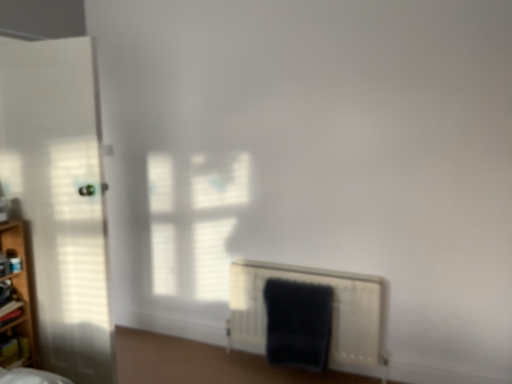
The height and width of the screenshot is (384, 512). In order to click on white matte radiator at lower center in this screenshot , I will do `click(332, 313)`.

This screenshot has height=384, width=512. Describe the element at coordinates (59, 196) in the screenshot. I see `white matte door at left` at that location.

Where is `dark blue plush bath towel at lower right`? This screenshot has height=384, width=512. dark blue plush bath towel at lower right is located at coordinates (298, 323).

The height and width of the screenshot is (384, 512). Find the location of `white matte radiator at lower center`. white matte radiator at lower center is located at coordinates (332, 313).

Considering the sizes of objects dark blue plush bath towel at lower right and white matte radiator at lower center in the image provided, who is smaller, dark blue plush bath towel at lower right or white matte radiator at lower center?

dark blue plush bath towel at lower right.

From the picture: Considering the positions of objects dark blue plush bath towel at lower right and white matte radiator at lower center in the image provided, who is more to the left, dark blue plush bath towel at lower right or white matte radiator at lower center?

dark blue plush bath towel at lower right is more to the left.

In order to click on bath towel that appears behind the white matte radiator at lower center in this screenshot , I will do `click(298, 323)`.

Can you see dark blue plush bath towel at lower right touching white matte radiator at lower center?

No, dark blue plush bath towel at lower right is not making contact with white matte radiator at lower center.

Is point (27, 260) positioned after point (7, 152)?

That is True.

Based on the photo, which of these two, wooden shelf at left or white matte door at left, is smaller?

Smaller between the two is wooden shelf at left.

Identify the location of door that is above the wooden shelf at left (from the image's perspective). The height and width of the screenshot is (384, 512). (59, 196).

Which object is wider, wooden shelf at left or white matte door at left?

With larger width is white matte door at left.

What's the angular difference between dark blue plush bath towel at lower right and wooden shelf at left's facing directions?

They differ by 87.2 degrees in their facing directions.

From the image's perspective, relative to wooden shelf at left, is dark blue plush bath towel at lower right above or below?

Based on their image positions, dark blue plush bath towel at lower right is located beneath wooden shelf at left.

Who is shorter, dark blue plush bath towel at lower right or wooden shelf at left?

Standing shorter between the two is dark blue plush bath towel at lower right.

Between dark blue plush bath towel at lower right and wooden shelf at left, which one has larger width?

wooden shelf at left is wider.

Looking at their sizes, would you say dark blue plush bath towel at lower right is wider or thinner than white matte door at left?

Clearly, dark blue plush bath towel at lower right has less width compared to white matte door at left.

Considering the points (285, 305) and (82, 50), which point is behind, point (285, 305) or point (82, 50)?

The point (285, 305) is farther.

From the image's perspective, is dark blue plush bath towel at lower right located beneath white matte door at left?

Correct, dark blue plush bath towel at lower right appears lower than white matte door at left in the image.

How different are the orientations of dark blue plush bath towel at lower right and white matte door at left in degrees?

The angle between the facing direction of dark blue plush bath towel at lower right and the facing direction of white matte door at left is 91 degrees.

Is white matte door at left situated inside wooden shelf at left or outside?

white matte door at left cannot be found inside wooden shelf at left.

Between white matte door at left and wooden shelf at left, which one has smaller size?

wooden shelf at left.

Is white matte door at left directly adjacent to wooden shelf at left?

No, white matte door at left is not in contact with wooden shelf at left.

Is white matte door at left aimed at wooden shelf at left?

No, white matte door at left is not facing towards wooden shelf at left.

Are white matte radiator at lower center and white matte door at left beside each other?

No, white matte radiator at lower center is not making contact with white matte door at left.

From the image's perspective, is white matte radiator at lower center below white matte door at left?

Yes.

Between white matte radiator at lower center and white matte door at left, which one has more height?

Standing taller between the two is white matte door at left.

Does point (295, 279) appear closer or farther from the camera than point (87, 155)?

Point (295, 279) appears to be farther away from the viewer than point (87, 155).

Which is in front, point (76, 129) or point (314, 350)?

The point (76, 129) is closer to the camera.

Is white matte door at left taller or shorter than dark blue plush bath towel at lower right?

Clearly, white matte door at left is taller compared to dark blue plush bath towel at lower right.

Is white matte door at left to the left of dark blue plush bath towel at lower right from the viewer's perspective?

Indeed, white matte door at left is positioned on the left side of dark blue plush bath towel at lower right.

Who is bigger, white matte door at left or dark blue plush bath towel at lower right?

Bigger between the two is white matte door at left.

The width and height of the screenshot is (512, 384). I want to click on radiator below the dark blue plush bath towel at lower right (from the image's perspective), so click(332, 313).

Where is `door on the right of wooden shelf at left`? Image resolution: width=512 pixels, height=384 pixels. door on the right of wooden shelf at left is located at coordinates (59, 196).

Estimate the real-world distances between objects in this image. Which object is further from white matte door at left, white matte radiator at lower center or wooden shelf at left?

The object further to white matte door at left is white matte radiator at lower center.

When comparing their distances from white matte radiator at lower center, does dark blue plush bath towel at lower right or wooden shelf at left seem closer?

dark blue plush bath towel at lower right.

Which object lies further to the anchor point wooden shelf at left, white matte door at left or dark blue plush bath towel at lower right?

Based on the image, dark blue plush bath towel at lower right appears to be further to wooden shelf at left.

From the image, which object appears to be nearer to dark blue plush bath towel at lower right, white matte radiator at lower center or white matte door at left?

Among the two, white matte radiator at lower center is located nearer to dark blue plush bath towel at lower right.

Considering their positions, is white matte door at left positioned further to dark blue plush bath towel at lower right than wooden shelf at left?

wooden shelf at left is positioned further to the anchor dark blue plush bath towel at lower right.

Which object lies nearer to the anchor point dark blue plush bath towel at lower right, white matte radiator at lower center or wooden shelf at left?

white matte radiator at lower center is closer to dark blue plush bath towel at lower right.

Based on their spatial positions, is dark blue plush bath towel at lower right or white matte radiator at lower center further from white matte door at left?

white matte radiator at lower center is further to white matte door at left.

From the image, which object appears to be farther from wooden shelf at left, white matte radiator at lower center or dark blue plush bath towel at lower right?

Based on the image, dark blue plush bath towel at lower right appears to be further to wooden shelf at left.

Image resolution: width=512 pixels, height=384 pixels. In order to click on door between wooden shelf at left and white matte radiator at lower center in this screenshot , I will do `click(59, 196)`.

Where is `door between wooden shelf at left and dark blue plush bath towel at lower right in the horizontal direction`? This screenshot has width=512, height=384. door between wooden shelf at left and dark blue plush bath towel at lower right in the horizontal direction is located at coordinates (59, 196).

This screenshot has width=512, height=384. I want to click on bath towel situated between white matte door at left and white matte radiator at lower center from left to right, so click(298, 323).

Image resolution: width=512 pixels, height=384 pixels. I want to click on bath towel between wooden shelf at left and white matte radiator at lower center in the horizontal direction, so click(298, 323).